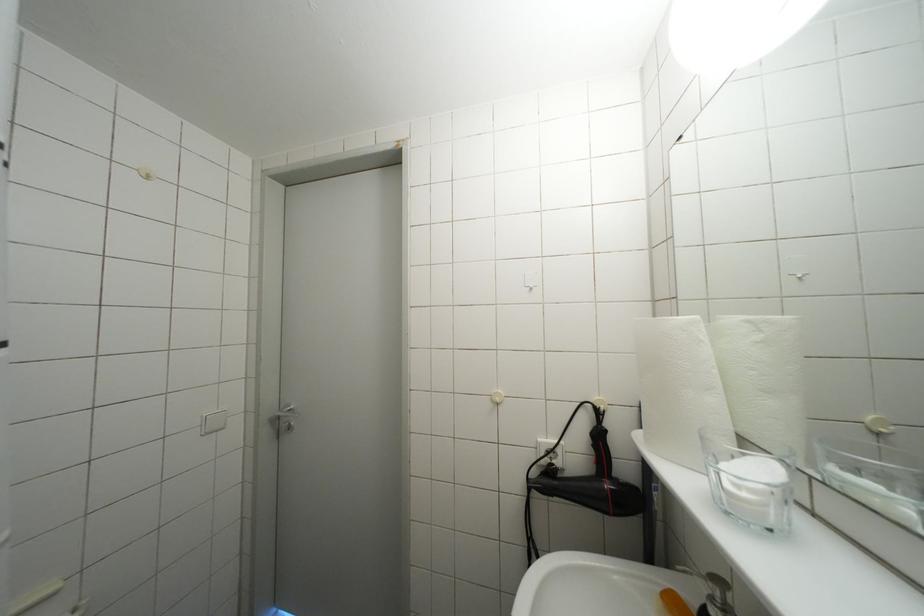
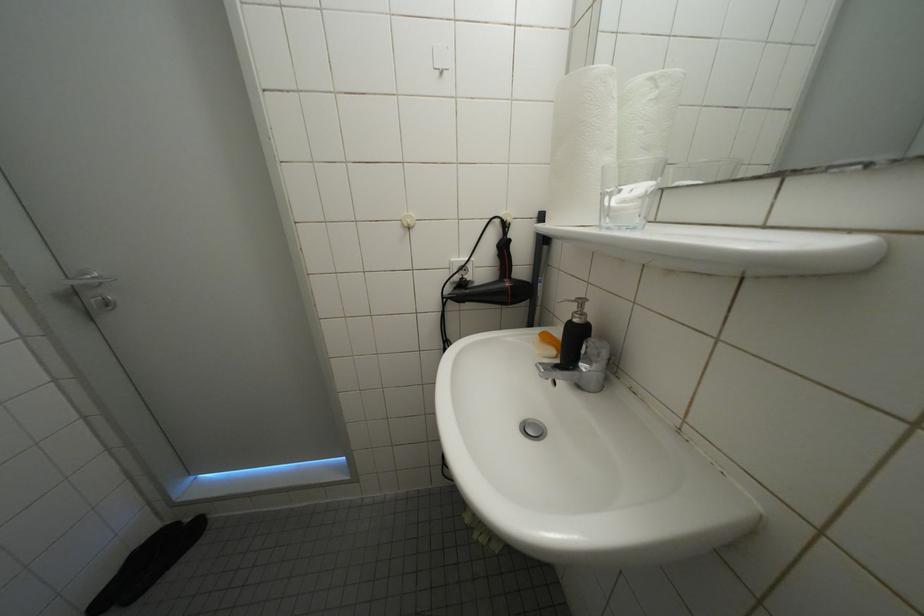
The first image is from the beginning of the video and the second image is from the end. How did the camera likely rotate when shooting the video?

The camera's rotation is toward right-down.